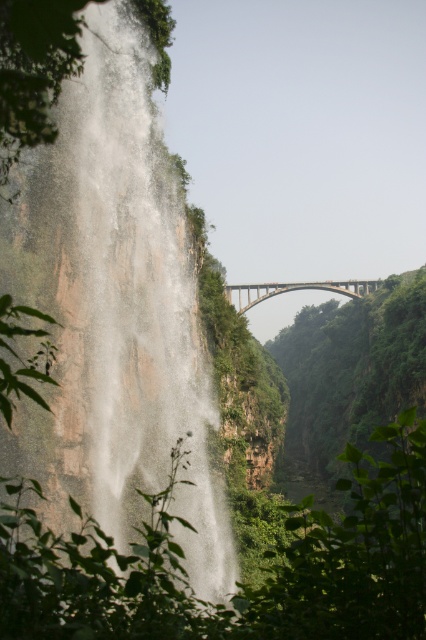
Does white misty waterfall at left appear over brown concrete arch bridge at center?

No, white misty waterfall at left is not above brown concrete arch bridge at center.

Is the position of white misty waterfall at left less distant than that of brown concrete arch bridge at center?

Yes, it is.

Is point (57, 259) farther from viewer compared to point (264, 285)?

No.

Locate an element on the screen. This screenshot has height=640, width=426. white misty waterfall at left is located at coordinates (115, 312).